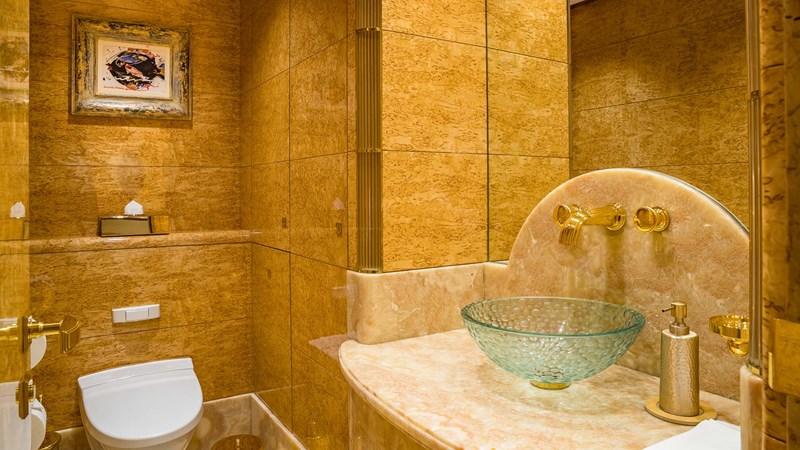
Locate an element on the screen. handle is located at coordinates (678, 308).